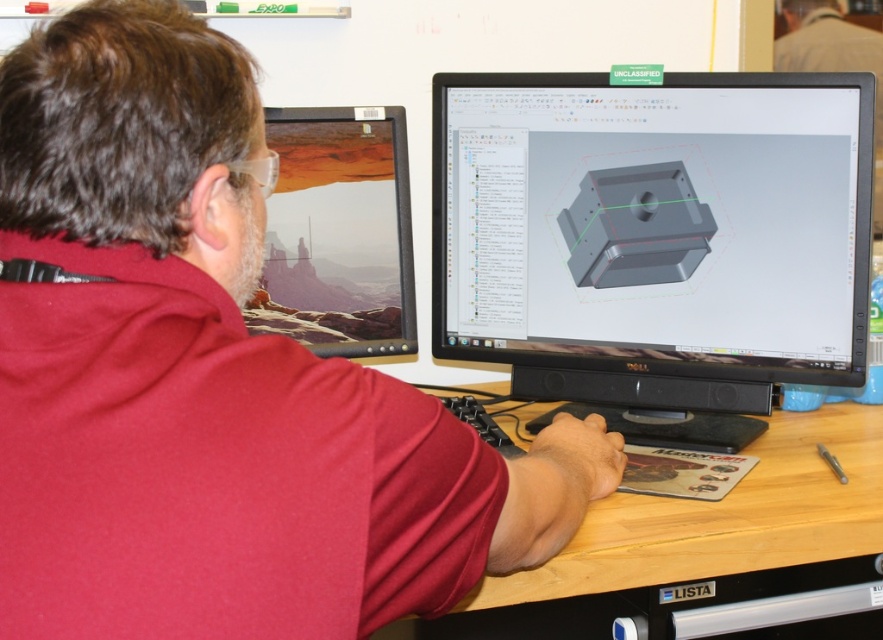
Can you confirm if matte black monitor at center is shorter than light brown wood at center?

In fact, matte black monitor at center may be taller than light brown wood at center.

In the scene shown: Does matte black monitor at center appear under light brown wood at center?

No.

I want to click on matte black monitor at center, so click(654, 243).

I want to click on matte black monitor at center, so click(x=654, y=243).

Is red matte shirt at center taller than matte black monitor at center?

No, red matte shirt at center is not taller than matte black monitor at center.

Locate an element on the screen. The image size is (883, 640). red matte shirt at center is located at coordinates (212, 380).

The width and height of the screenshot is (883, 640). I want to click on red matte shirt at center, so click(212, 380).

I want to click on red matte shirt at center, so click(212, 380).

In order to click on red matte shirt at center in this screenshot , I will do `click(212, 380)`.

From the picture: Which is more to the left, red matte shirt at center or matte black monitor at left?

matte black monitor at left is more to the left.

Where is `red matte shirt at center`? The image size is (883, 640). red matte shirt at center is located at coordinates (212, 380).